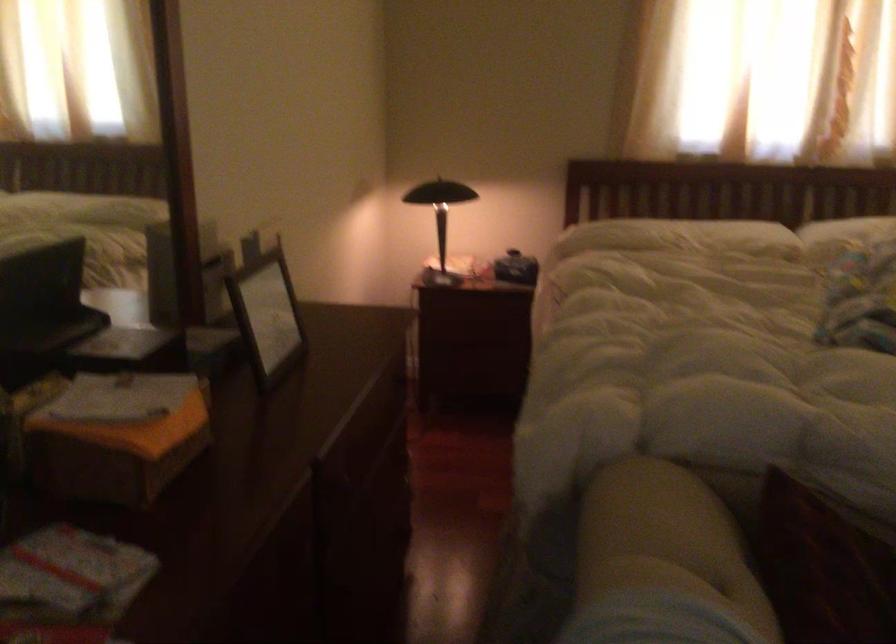
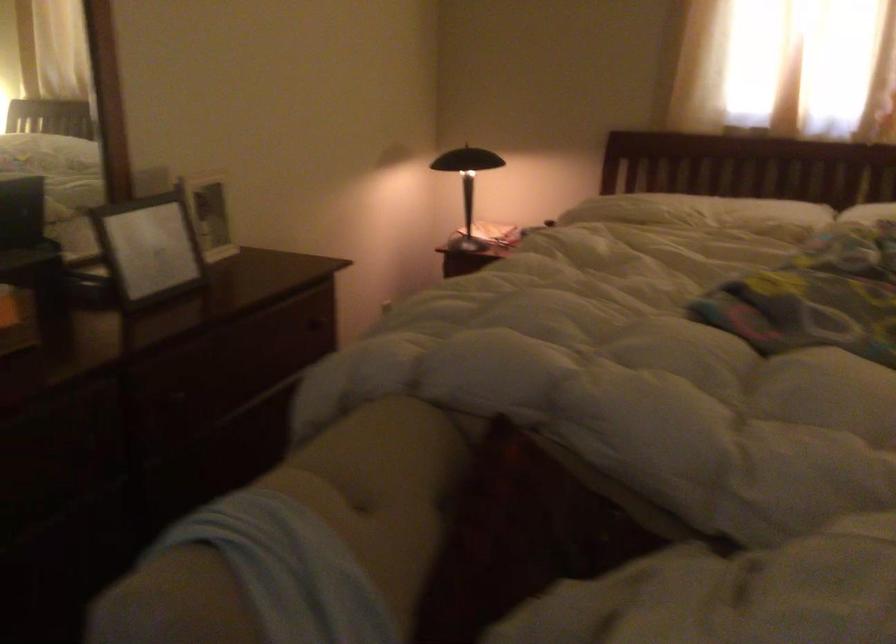
Question: What movement of the cameraman would produce the second image?

Choices:
 (A) Left
 (B) Right
 (C) Forward
 (D) Backward

Answer: (B)